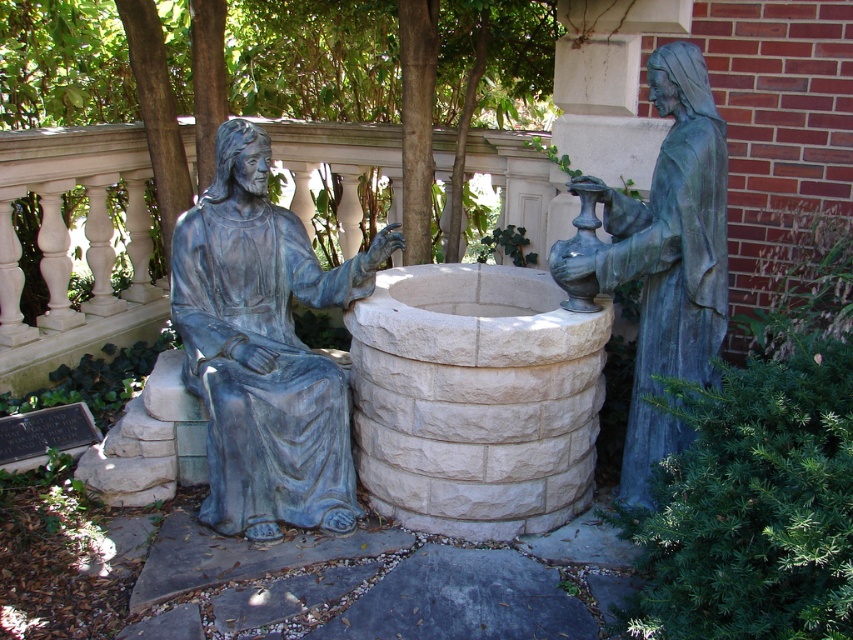
Does blue patina statue at left appear on the left side of bronze statue at right?

Yes, blue patina statue at left is to the left of bronze statue at right.

Which is in front, point (189, 328) or point (670, 433)?

Positioned in front is point (670, 433).

Find the location of `blue patina statue at left`. blue patina statue at left is located at coordinates pos(264,349).